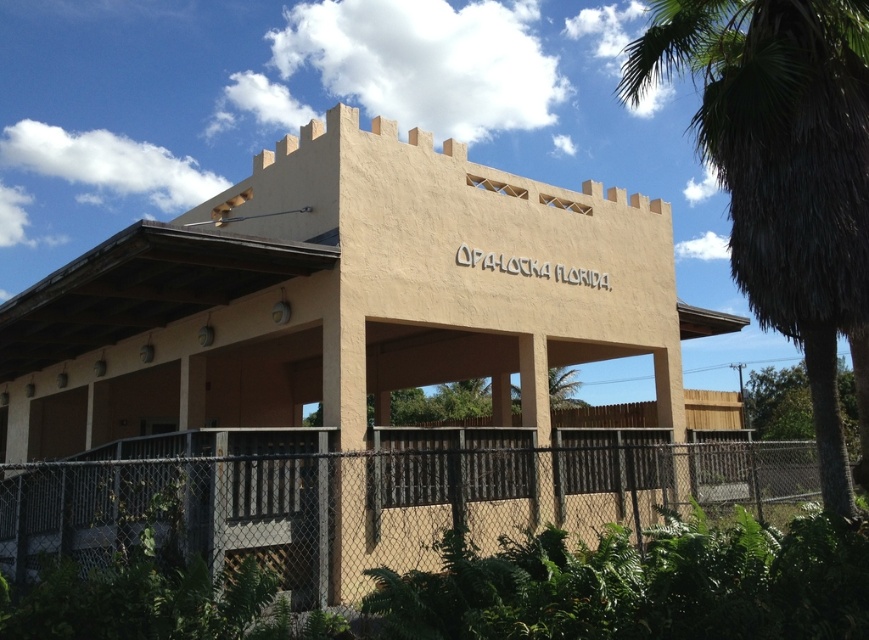
Which is in front, point (615, 481) or point (652, 10)?

Point (652, 10) is more forward.

Is point (574, 467) more distant than point (798, 168)?

Yes, it is.

Between point (286, 480) and point (655, 76), which one is positioned in front?

Point (286, 480) is more forward.

Locate an element on the screen. The image size is (869, 640). black chain-link fence at lower center is located at coordinates (380, 502).